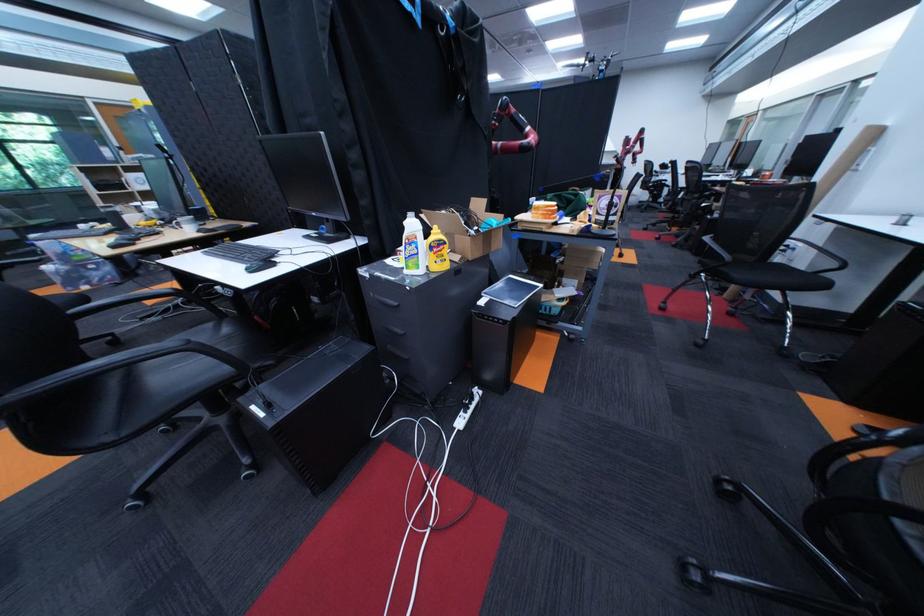
You are a GUI agent. You are given a task and a screenshot of the screen. Output one action in this format:
    pyautogui.click(x=<x>, y=<y>)
    Task: Click on the white tablet
    
    Given the screenshot: What is the action you would take?
    pyautogui.click(x=608, y=206)